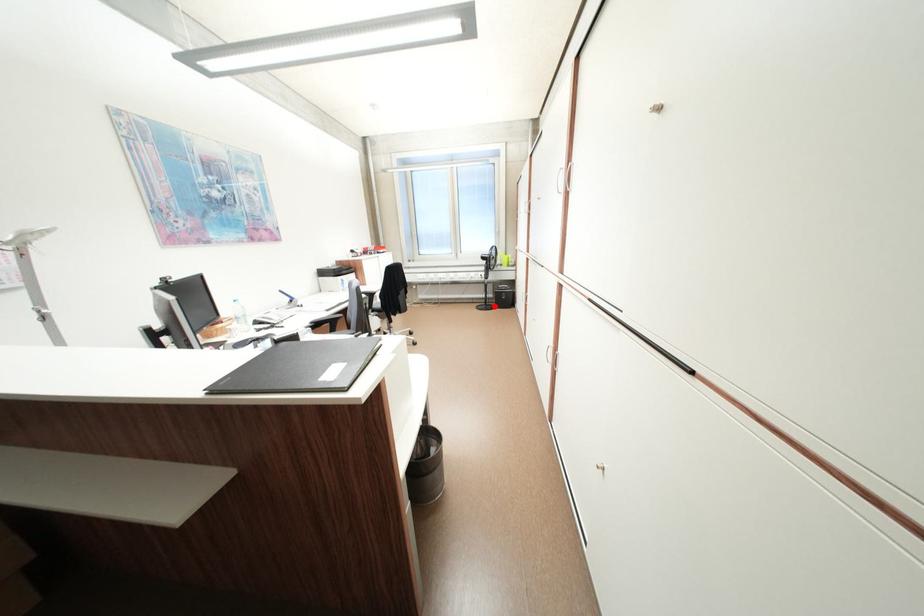
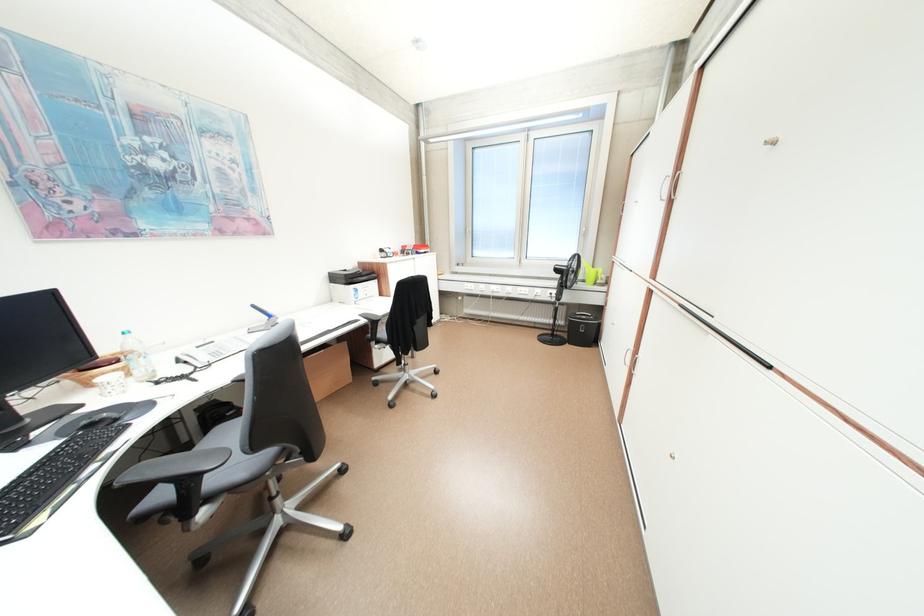
Where in the second image is the point corresponding to the highlighted location from the first image?

(561, 338)